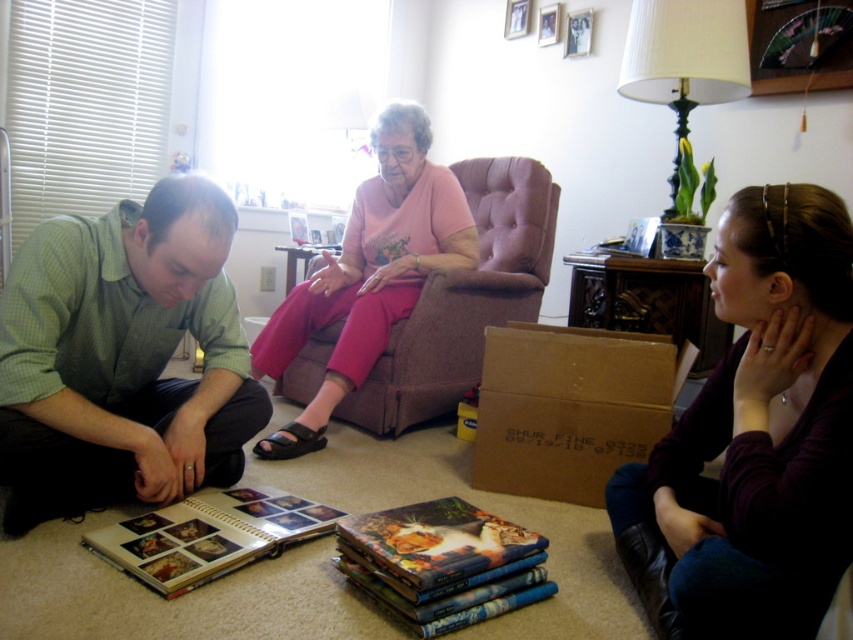
You are a delivery person who just arrived at this location. You need to place a package that is 18 inches long on the floor between the brown cardboard box at lower center and the hardcover book at center. Is there enough space for the package?

The brown cardboard box at lower center and the hardcover book at center are 22.83 inches apart. Since the package is 18 inches long, there is enough space between them to place the package.

You are organizing a photo album and need to place a green checkered shirt at lower left and a pink fabric chair at center. Based on the scene, which object is positioned lower in the image?

The green checkered shirt at lower left is located below the pink fabric chair at center, so it is positioned lower in the image.

You are organizing items in a room and need to place the brown cardboard box at lower center and the hardcover book at center into storage. The storage shelf has a height limit of 12 inches. Can both items fit vertically on the shelf without exceeding the height limit?

The brown cardboard box at lower center has a larger size compared to hardcover book at center. Since the box is larger, it might exceed the 12 inch height limit. Check the box and book dimensions to confirm.